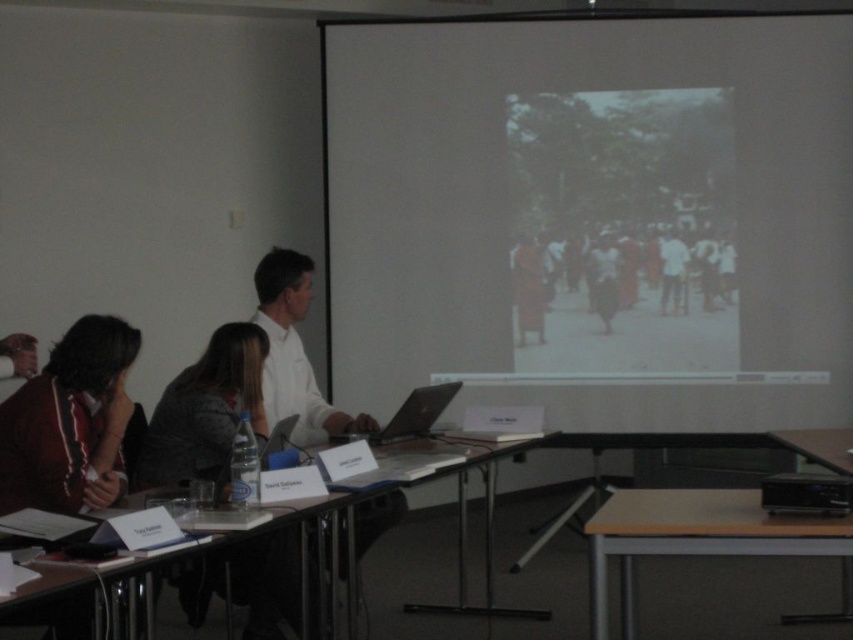
Which of these two, white matte projection screen at upper center or dark brown fabric at center, stands shorter?

With less height is dark brown fabric at center.

Between white matte projection screen at upper center and dark brown fabric at center, which one appears on the left side from the viewer's perspective?

white matte projection screen at upper center is more to the left.

Where is `white matte projection screen at upper center`? The height and width of the screenshot is (640, 853). white matte projection screen at upper center is located at coordinates (582, 189).

Based on the photo, is patterned fabric jacket at lower left shorter than white matte shirt at center?

Yes.

The height and width of the screenshot is (640, 853). What do you see at coordinates (206, 410) in the screenshot?
I see `patterned fabric jacket at lower left` at bounding box center [206, 410].

At what (x,y) coordinates should I click in order to perform the action: click on patterned fabric jacket at lower left. Please return your answer as a coordinate pair (x, y). This screenshot has width=853, height=640. Looking at the image, I should click on (206, 410).

Which is more to the left, white matte projection screen at upper center or light brown wood table at lower right?

Positioned to the left is light brown wood table at lower right.

Who is more distant from viewer, (x=346, y=122) or (x=764, y=531)?

The point (x=346, y=122) is more distant.

The height and width of the screenshot is (640, 853). I want to click on white matte projection screen at upper center, so click(x=582, y=189).